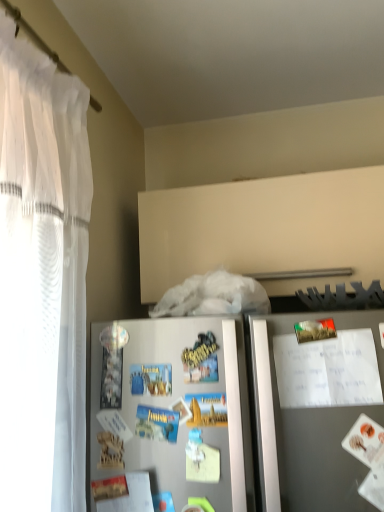
Question: In the image, is satin silver refrigerator at lower center positioned in front of or behind white paper at upper right?

Choices:
 (A) behind
 (B) front

Answer: (B)

Question: From their relative heights in the image, would you say satin silver refrigerator at lower center is taller or shorter than white paper at upper right?

Choices:
 (A) short
 (B) tall

Answer: (B)

Question: Based on their sizes in the image, would you say satin silver refrigerator at lower center is bigger or smaller than white paper at upper right?

Choices:
 (A) small
 (B) big

Answer: (B)

Question: Is white paper at upper right inside the boundaries of satin silver refrigerator at lower center, or outside?

Choices:
 (A) inside
 (B) outside

Answer: (A)

Question: From the image's perspective, is white paper at upper right located above or below satin silver refrigerator at lower center?

Choices:
 (A) above
 (B) below

Answer: (A)

Question: From a real-world perspective, is white paper at upper right above or below satin silver refrigerator at lower center?

Choices:
 (A) below
 (B) above

Answer: (B)

Question: Does point (345, 379) appear closer or farther from the camera than point (157, 448)?

Choices:
 (A) farther
 (B) closer

Answer: (B)